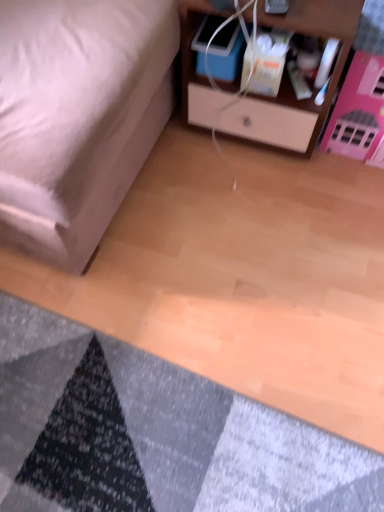
Question: Can you confirm if wooden nightstand at upper right is shorter than textured gray mat at lower left?

Choices:
 (A) yes
 (B) no

Answer: (B)

Question: From a real-world perspective, is wooden nightstand at upper right positioned over textured gray mat at lower left based on gravity?

Choices:
 (A) yes
 (B) no

Answer: (A)

Question: Does wooden nightstand at upper right have a greater height compared to textured gray mat at lower left?

Choices:
 (A) yes
 (B) no

Answer: (A)

Question: Is wooden nightstand at upper right aimed at textured gray mat at lower left?

Choices:
 (A) yes
 (B) no

Answer: (A)

Question: Can you confirm if wooden nightstand at upper right is wider than textured gray mat at lower left?

Choices:
 (A) no
 (B) yes

Answer: (A)

Question: From a real-world perspective, relative to matte white bed at lower left, is wooden nightstand at upper right vertically above or below?

Choices:
 (A) below
 (B) above

Answer: (A)

Question: Which is correct: wooden nightstand at upper right is inside matte white bed at lower left, or outside of it?

Choices:
 (A) outside
 (B) inside

Answer: (A)

Question: Considering the positions of wooden nightstand at upper right and matte white bed at lower left in the image, is wooden nightstand at upper right bigger or smaller than matte white bed at lower left?

Choices:
 (A) small
 (B) big

Answer: (A)

Question: Considering the relative positions of wooden nightstand at upper right and matte white bed at lower left in the image provided, is wooden nightstand at upper right to the left or to the right of matte white bed at lower left?

Choices:
 (A) right
 (B) left

Answer: (A)

Question: Visually, is matte white bed at lower left positioned to the left or to the right of textured gray mat at lower left?

Choices:
 (A) right
 (B) left

Answer: (B)

Question: Is matte white bed at lower left in front of or behind textured gray mat at lower left in the image?

Choices:
 (A) front
 (B) behind

Answer: (A)

Question: Is matte white bed at lower left situated inside textured gray mat at lower left or outside?

Choices:
 (A) outside
 (B) inside

Answer: (A)

Question: Is point (64, 75) positioned closer to the camera than point (269, 458)?

Choices:
 (A) closer
 (B) farther

Answer: (A)

Question: Does point (301, 444) appear closer or farther from the camera than point (31, 228)?

Choices:
 (A) farther
 (B) closer

Answer: (B)

Question: Is textured gray mat at lower left situated inside matte white bed at lower left or outside?

Choices:
 (A) inside
 (B) outside

Answer: (B)